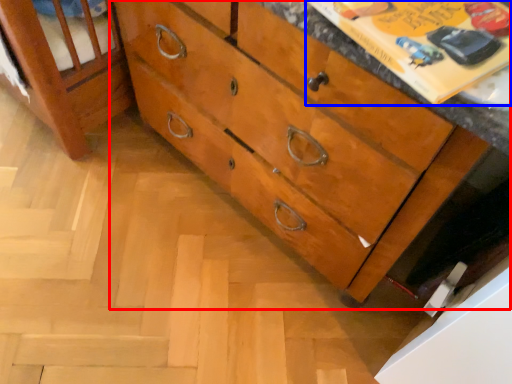
Question: Which of the following is the farthest to the observer, chest of drawers (highlighted by a red box) or paperback book (highlighted by a blue box)?

Choices:
 (A) chest of drawers
 (B) paperback book

Answer: (A)